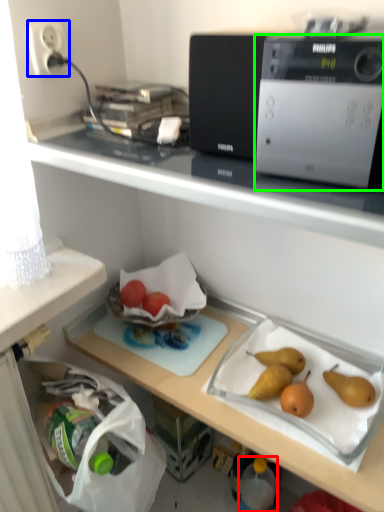
Question: Which object is positioned farthest from bottle (highlighted by a red box)? Select from electric outlet (highlighted by a blue box) and home appliance (highlighted by a green box).

Choices:
 (A) electric outlet
 (B) home appliance

Answer: (A)